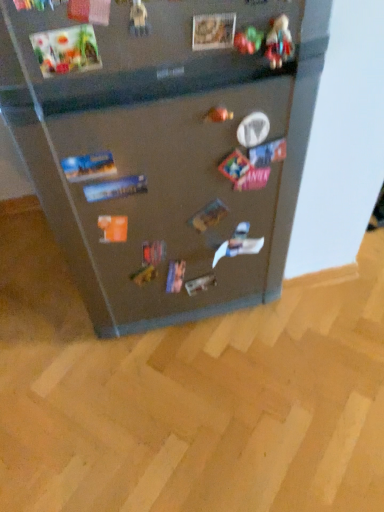
This screenshot has width=384, height=512. Find the location of `metallic refrigerator at center`. metallic refrigerator at center is located at coordinates (166, 146).

What do you see at coordinates (166, 146) in the screenshot? The width and height of the screenshot is (384, 512). I see `metallic refrigerator at center` at bounding box center [166, 146].

Locate an element on the screen. Image resolution: width=384 pixels, height=512 pixels. metallic refrigerator at center is located at coordinates (166, 146).